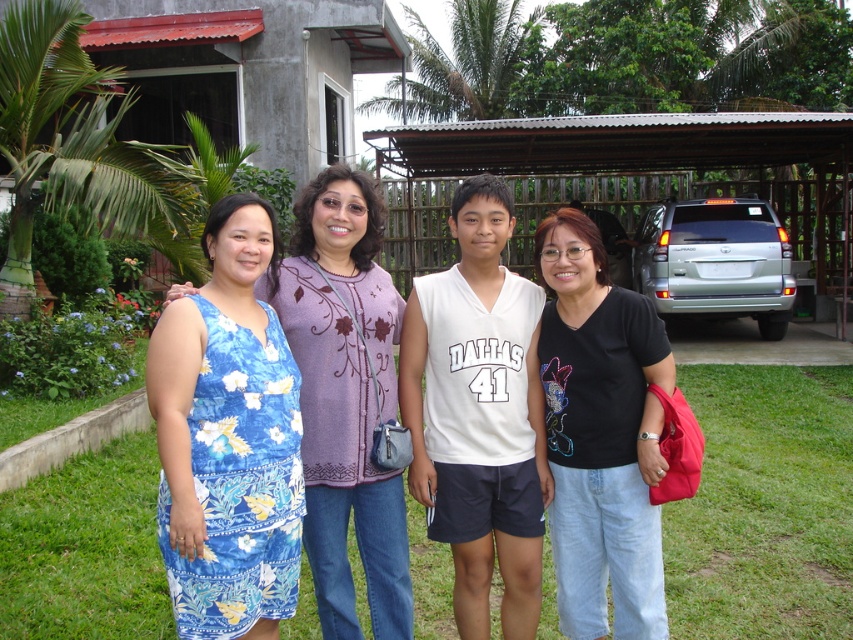
You are standing at the origin point in the image. There is a white jersey at center represented by point (479, 413). Can you tell me the direction of the white jersey at center from your current position?

Answer: The white jersey at center is located at coordinates (479, 413), so from the origin point, it is positioned to the right and slightly above.

You are a photographer setting up for a group photo. You need to ensure there is enough space between the blue floral dress at left and the black cotton shirt at center for a tripod to fit. The tripod requires at least 30 inches of space. Based on the scene, can the tripod be placed between them?

The distance between the blue floral dress at left and the black cotton shirt at center is 29.65 inches, which is slightly less than the required 30 inches. Therefore, the tripod cannot be placed between them without adjusting their positions.